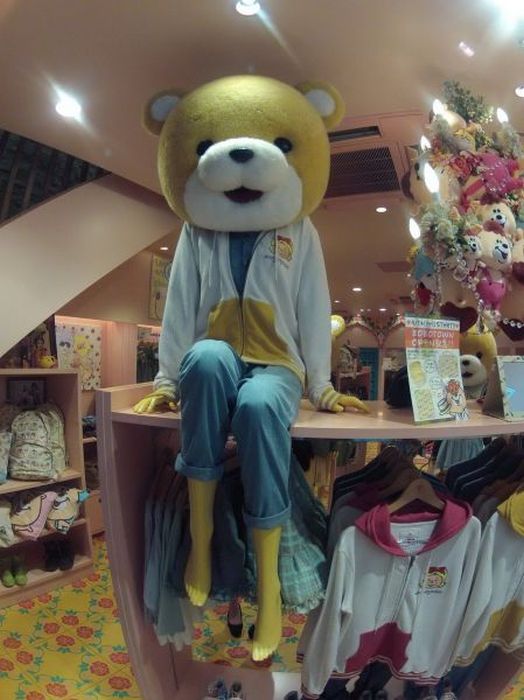
The width and height of the screenshot is (524, 700). What are the coordinates of `pillows` in the screenshot? It's located at (41, 524), (58, 517).